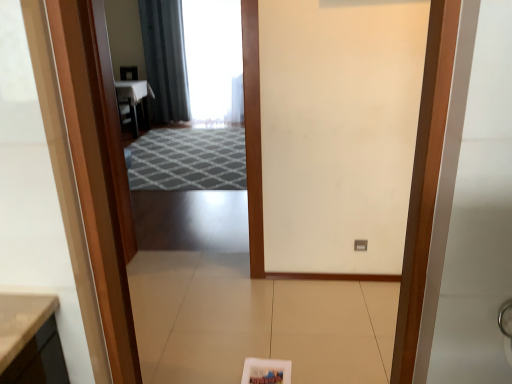
Question: Considering the relative positions of dark gray fabric curtain at upper center and gray textured rug at center in the image provided, is dark gray fabric curtain at upper center to the right of gray textured rug at center from the viewer's perspective?

Choices:
 (A) yes
 (B) no

Answer: (B)

Question: Is gray textured rug at center located within dark gray fabric curtain at upper center?

Choices:
 (A) no
 (B) yes

Answer: (A)

Question: Can you confirm if dark gray fabric curtain at upper center is positioned to the left of gray textured rug at center?

Choices:
 (A) no
 (B) yes

Answer: (B)

Question: Is dark gray fabric curtain at upper center further to the viewer compared to gray textured rug at center?

Choices:
 (A) yes
 (B) no

Answer: (A)

Question: Considering the relative sizes of dark gray fabric curtain at upper center and gray textured rug at center in the image provided, is dark gray fabric curtain at upper center thinner than gray textured rug at center?

Choices:
 (A) yes
 (B) no

Answer: (A)

Question: Is dark gray fabric curtain at upper center turned away from gray textured rug at center?

Choices:
 (A) yes
 (B) no

Answer: (B)

Question: Is wooden door at center far from gray textured rug at center?

Choices:
 (A) yes
 (B) no

Answer: (A)

Question: Considering the relative sizes of wooden door at center and gray textured rug at center in the image provided, is wooden door at center bigger than gray textured rug at center?

Choices:
 (A) yes
 (B) no

Answer: (B)

Question: Considering the relative positions of wooden door at center and gray textured rug at center in the image provided, is wooden door at center in front of gray textured rug at center?

Choices:
 (A) yes
 (B) no

Answer: (A)

Question: Does wooden door at center have a lesser height compared to gray textured rug at center?

Choices:
 (A) yes
 (B) no

Answer: (B)

Question: From a real-world perspective, is wooden door at center located higher than gray textured rug at center?

Choices:
 (A) yes
 (B) no

Answer: (A)

Question: Is wooden door at center completely or partially outside of gray textured rug at center?

Choices:
 (A) yes
 (B) no

Answer: (A)

Question: Is gray textured rug at center facing away from dark gray fabric curtain at upper center?

Choices:
 (A) yes
 (B) no

Answer: (B)